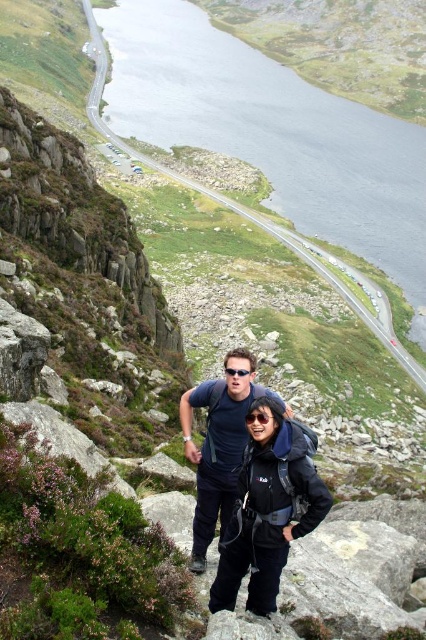
Between point (235, 460) and point (233, 369), which one is positioned in front?

Point (233, 369) is in front.

Measure the distance from dark blue fabric shirt at center to black plastic sunglasses at center.

dark blue fabric shirt at center is 10.60 meters away from black plastic sunglasses at center.

Where is `dark blue fabric shirt at center`? This screenshot has width=426, height=640. dark blue fabric shirt at center is located at coordinates (218, 445).

At what (x,y) coordinates should I click in order to perform the action: click on dark blue fabric shirt at center. Please return your answer as a coordinate pair (x, y). This screenshot has height=640, width=426. Looking at the image, I should click on (218, 445).

Who is positioned more to the right, dark blue fabric shirt at center or black matte goggles at center?

From the viewer's perspective, black matte goggles at center appears more on the right side.

Between point (215, 442) and point (247, 419), which one is positioned in front?

Point (247, 419) is more forward.

Find the location of a particular element. This screenshot has height=640, width=426. dark blue fabric shirt at center is located at coordinates (218, 445).

In order to click on matte black jacket at center in this screenshot , I will do `click(267, 512)`.

Based on the photo, between matte black jacket at center and black plastic sunglasses at center, which one appears on the right side from the viewer's perspective?

matte black jacket at center is more to the right.

You are a GUI agent. You are given a task and a screenshot of the screen. Output one action in this format:
    pyautogui.click(x=<x>, y=<y>)
    Task: Click on the matte black jacket at center
    Image resolution: width=426 pixels, height=640 pixels.
    Given the screenshot: What is the action you would take?
    pyautogui.click(x=267, y=512)